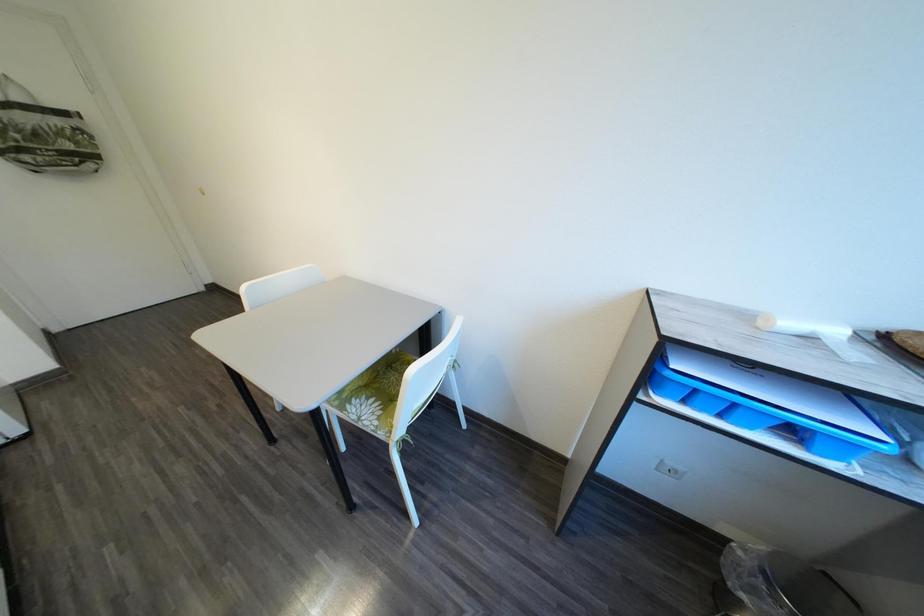
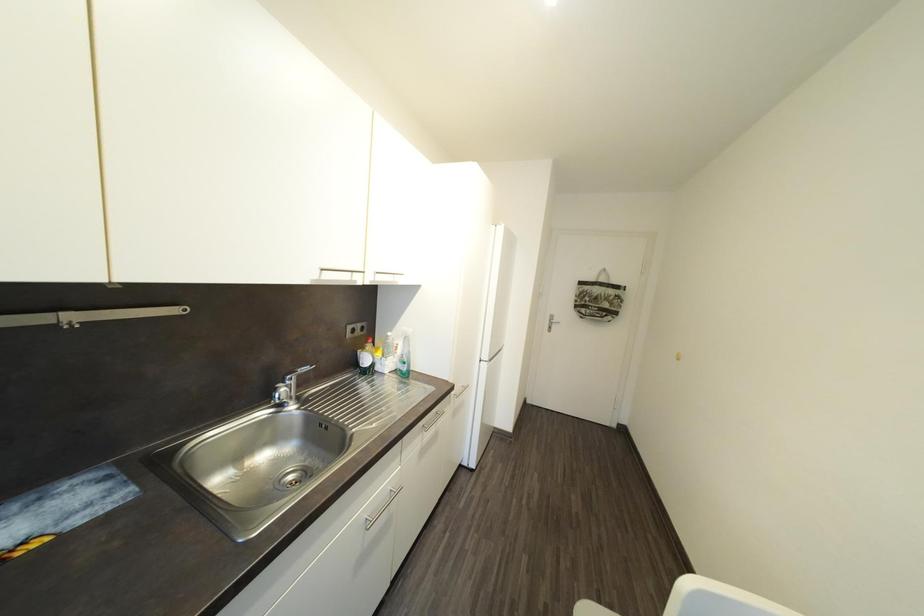
Question: Based on the continuous images, in which direction is the camera rotating? Reply with the corresponding letter.

Choices:
 (A) Left
 (B) Right
 (C) Up
 (D) Down

Answer: (A)